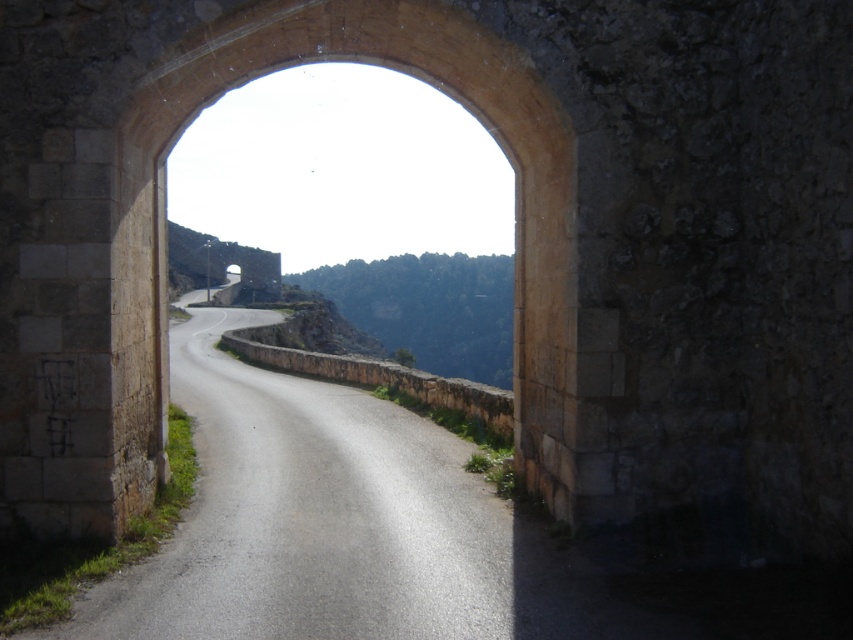
You are standing in front of the brown stone archway at center and want to walk to the asphalt road at center. Which direction should you move relative to the archway?

You should move forward towards the asphalt road at center because it is in front of the brown stone archway at center.

In the scene shown: You are standing at the entrance of the scenic area and want to take a photo of the brown stone archway at center and the asphalt road at center. Which object is positioned lower in the frame?

The asphalt road at center is located below the brown stone archway at center, so it is positioned lower in the frame.

You are driving a car that is 2 meters wide. You see the asphalt road at center and the brown stone archway at center. Can your car pass through the archway?

The asphalt road at center is larger in size than the brown stone archway at center, so the car cannot pass through the archway because the archway is smaller than the road.